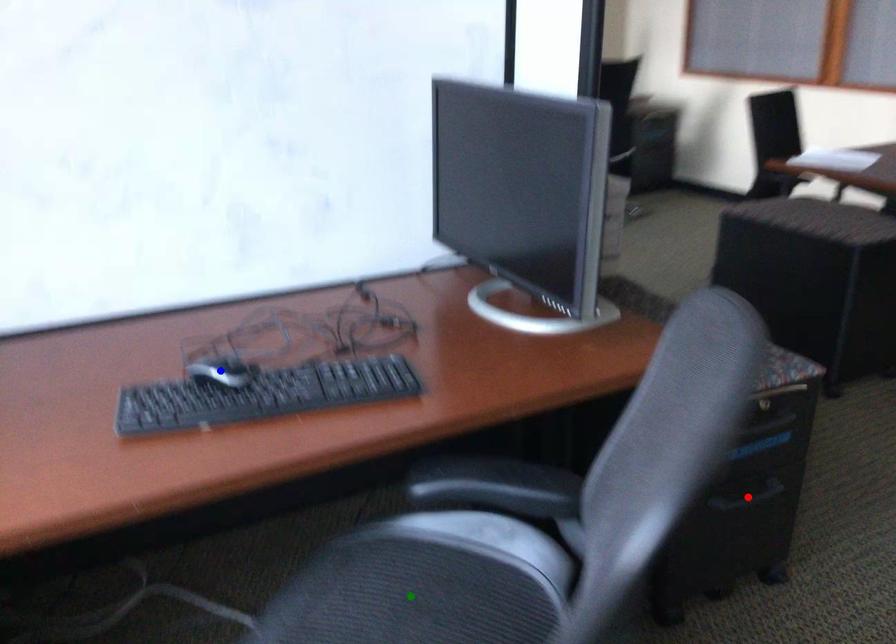
From the picture: Order these from nearest to farthest:
1. blue point
2. green point
3. red point

green point < blue point < red point